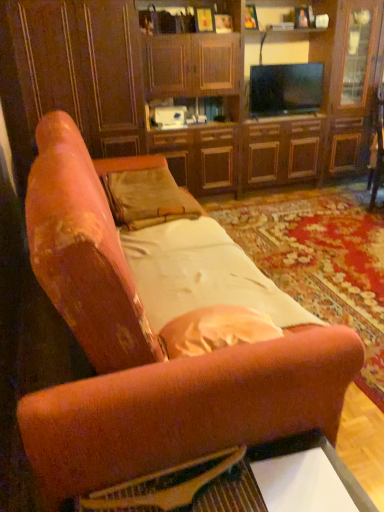
Where is `wooden glossy table at lower center`? Image resolution: width=384 pixels, height=512 pixels. wooden glossy table at lower center is located at coordinates (246, 483).

Is wooden guitar at lower center wider or thinner than velvet orange couch at center?

wooden guitar at lower center is thinner than velvet orange couch at center.

Which is in front, wooden guitar at lower center or velvet orange couch at center?

Positioned in front is velvet orange couch at center.

Where is `flat that appears below the velvet orange couch at center (from a real-world perspective)`? The image size is (384, 512). flat that appears below the velvet orange couch at center (from a real-world perspective) is located at coordinates (165, 486).

Between wooden guitar at lower center and velvet orange couch at center, which one has more height?

velvet orange couch at center.

Is wooden guitar at lower center in front of or behind wooden cabinet at center in the image?

Visually, wooden guitar at lower center is located in front of wooden cabinet at center.

Which is farther from the camera, (x=133, y=495) or (x=165, y=144)?

Point (x=165, y=144)

From the image's perspective, which object appears higher, wooden guitar at lower center or wooden cabinet at center?

wooden cabinet at center.

Is wooden guitar at lower center not close to wooden glossy table at lower center?

No.

Does wooden guitar at lower center have a smaller size compared to wooden glossy table at lower center?

Yes, wooden guitar at lower center is smaller than wooden glossy table at lower center.

Between point (216, 464) and point (156, 497), which one is positioned in front?

The point (156, 497) is closer.

Is wooden guitar at lower center facing away from wooden glossy table at lower center?

Yes, wooden guitar at lower center is positioned with its back facing wooden glossy table at lower center.

Is flat-screen tv at upper center taller or shorter than white satin sheet at center?

Clearly, flat-screen tv at upper center is taller compared to white satin sheet at center.

From the picture: Can you confirm if flat-screen tv at upper center is wider than white satin sheet at center?

No.

Is flat-screen tv at upper center looking in the opposite direction of white satin sheet at center?

No, flat-screen tv at upper center's orientation is not away from white satin sheet at center.

Looking at this image, from the image's perspective, which one is positioned lower, flat-screen tv at upper center or white satin sheet at center?

From the image's view, white satin sheet at center is below.

In terms of width, does velvet orange couch at center look wider or thinner when compared to wooden cabinet at center?

Clearly, velvet orange couch at center has more width compared to wooden cabinet at center.

Is velvet orange couch at center located outside wooden cabinet at center?

velvet orange couch at center lies outside wooden cabinet at center's area.

Is velvet orange couch at center taller than wooden cabinet at center?

No.

Can you confirm if wooden glossy table at lower center is shorter than velvet orange couch at center?

Yes.

Considering the sizes of wooden glossy table at lower center and velvet orange couch at center in the image, is wooden glossy table at lower center bigger or smaller than velvet orange couch at center?

Clearly, wooden glossy table at lower center is smaller in size than velvet orange couch at center.

How distant is wooden glossy table at lower center from velvet orange couch at center?

They are 12.92 inches apart.

From the image's perspective, which one is positioned higher, velvet orange couch at center or white satin sheet at center?

From the image's view, velvet orange couch at center is above.

In terms of height, does velvet orange couch at center look taller or shorter compared to white satin sheet at center?

velvet orange couch at center is taller than white satin sheet at center.

Does velvet orange couch at center appear on the left side of white satin sheet at center?

Correct, you'll find velvet orange couch at center to the left of white satin sheet at center.

Considering the relative sizes of velvet orange couch at center and white satin sheet at center in the image provided, is velvet orange couch at center thinner than white satin sheet at center?

No.

Image resolution: width=384 pixels, height=512 pixels. In order to click on flat on the right of velvet orange couch at center in this screenshot , I will do `click(165, 486)`.

The width and height of the screenshot is (384, 512). I want to click on flat that appears below the wooden cabinet at center (from a real-world perspective), so click(x=165, y=486).

Based on the photo, considering their positions, is wooden guitar at lower center positioned further to wooden glossy table at lower center than velvet orange couch at center?

Among the two, velvet orange couch at center is located further to wooden glossy table at lower center.

Considering their positions, is flat-screen tv at upper center positioned closer to wooden guitar at lower center than white satin sheet at center?

white satin sheet at center is closer to wooden guitar at lower center.

From the image, which object appears to be farther from wooden cabinet at center, white satin sheet at center or wooden guitar at lower center?

wooden guitar at lower center.

Which object lies further to the anchor point wooden guitar at lower center, velvet orange couch at center or white satin sheet at center?

white satin sheet at center is positioned further to the anchor wooden guitar at lower center.

Estimate the real-world distances between objects in this image. Which object is further from flat-screen tv at upper center, suede-like beige pillow at center or velvet orange couch at center?

Based on the image, velvet orange couch at center appears to be further to flat-screen tv at upper center.

Estimate the real-world distances between objects in this image. Which object is closer to white satin sheet at center, wooden cabinet at center or wooden guitar at lower center?

wooden guitar at lower center.

From the image, which object appears to be farther from white satin sheet at center, flat-screen tv at upper center or suede-like beige pillow at center?

flat-screen tv at upper center lies further to white satin sheet at center than the other object.

When comparing their distances from wooden guitar at lower center, does velvet orange couch at center or wooden cabinet at center seem further?

Among the two, wooden cabinet at center is located further to wooden guitar at lower center.

This screenshot has width=384, height=512. I want to click on cabinetry positioned between velvet orange couch at center and flat-screen tv at upper center from near to far, so click(x=189, y=88).

What are the coordinates of `sheet between wooden guitar at lower center and suede-like beige pillow at center from front to back` in the screenshot? It's located at (201, 274).

This screenshot has height=512, width=384. In order to click on pillow positioned between wooden guitar at lower center and wooden cabinet at center from near to far in this screenshot , I will do `click(147, 198)`.

I want to click on pillow between wooden guitar at lower center and flat-screen tv at upper center in the front-back direction, so click(147, 198).